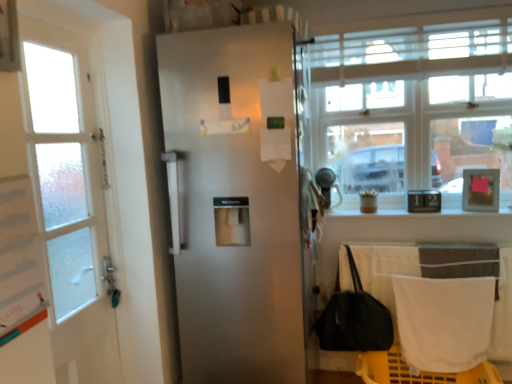
Question: Considering the relative positions of black fabric handbag at lower right and clear glass window at upper right in the image provided, is black fabric handbag at lower right to the left or to the right of clear glass window at upper right?

Choices:
 (A) left
 (B) right

Answer: (A)

Question: From a real-world perspective, is black fabric handbag at lower right positioned above or below clear glass window at upper right?

Choices:
 (A) below
 (B) above

Answer: (A)

Question: Estimate the real-world distances between objects in this image. Which object is farther from the satin white refrigerator at center?

Choices:
 (A) white fabric towel at lower right
 (B) black fabric handbag at lower right
 (C) clear glass window at upper right

Answer: (C)

Question: Which object is positioned farthest from the clear glass window at upper right?

Choices:
 (A) satin white refrigerator at center
 (B) white fabric towel at lower right
 (C) black fabric handbag at lower right

Answer: (A)